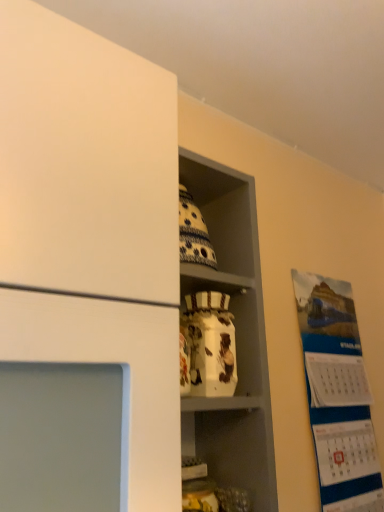
What are the coordinates of `white glossy jar at center` in the screenshot? It's located at (213, 281).

Where is `white glossy jar at center`? The width and height of the screenshot is (384, 512). white glossy jar at center is located at coordinates (213, 281).

Measure the distance between white glossy jar at center and white paper calendar at right.

They are 22.80 inches apart.

Which point is more forward, (191,268) or (336,439)?

Point (191,268)

Between white glossy jar at center and white paper calendar at right, which one is positioned behind?

white paper calendar at right is behind.

Is white glossy jar at center oriented away from white paper calendar at right?

No, white glossy jar at center's orientation is not away from white paper calendar at right.

Considering the sizes of objects white glossy vase at center and white paper calendar at right in the image provided, who is smaller, white glossy vase at center or white paper calendar at right?

white paper calendar at right.

Which object is positioned more to the left, white glossy vase at center or white paper calendar at right?

white glossy vase at center is more to the left.

Find the location of `shelf in front of the white paper calendar at right`. shelf in front of the white paper calendar at right is located at coordinates (236, 336).

Looking at their sizes, would you say white glossy jar at center is wider or thinner than white glossy vase at center?

white glossy jar at center is thinner than white glossy vase at center.

Is there a large distance between white glossy jar at center and white glossy vase at center?

No.

How distant is white glossy jar at center from white glossy vase at center?

white glossy jar at center and white glossy vase at center are 3.63 inches apart from each other.

In the image, is white paper calendar at right positioned in front of or behind white glossy jar at center?

In the image, white paper calendar at right appears behind white glossy jar at center.

Would you say white paper calendar at right is inside or outside white glossy jar at center?

white paper calendar at right lies outside white glossy jar at center.

Is white paper calendar at right to the left of white glossy jar at center from the viewer's perspective?

Incorrect, white paper calendar at right is not on the left side of white glossy jar at center.

Considering the points (328, 278) and (190, 285), which point is in front, point (328, 278) or point (190, 285)?

Point (190, 285)

Considering the positions of point (226, 410) and point (223, 280), is point (226, 410) closer or farther from the camera than point (223, 280)?

Clearly, point (226, 410) is closer to the camera than point (223, 280).

Considering the relative sizes of white glossy vase at center and white glossy jar at center in the image provided, is white glossy vase at center wider than white glossy jar at center?

Correct, the width of white glossy vase at center exceeds that of white glossy jar at center.

From a real-world perspective, which is physically below, white glossy vase at center or white glossy jar at center?

From a 3D spatial view, white glossy jar at center is below.

From the image's perspective, is white paper calendar at right under white glossy vase at center?

Correct, white paper calendar at right appears lower than white glossy vase at center in the image.

From a real-world perspective, who is located lower, white paper calendar at right or white glossy vase at center?

white paper calendar at right is physically lower.

Is white paper calendar at right aimed at white glossy vase at center?

No.

Is point (331, 486) in front of point (229, 410)?

No, (331, 486) is behind (229, 410).

The width and height of the screenshot is (384, 512). Identify the location of cabinet in front of the white paper calendar at right. (213, 281).

Find the location of a particular element. The width and height of the screenshot is (384, 512). shelf on the left of white paper calendar at right is located at coordinates (236, 336).

From the image, which object appears to be nearer to white glossy jar at center, white glossy vase at center or white paper calendar at right?

white glossy vase at center is closer to white glossy jar at center.

Estimate the real-world distances between objects in this image. Which object is closer to white paper calendar at right, white glossy vase at center or white glossy jar at center?

Answer: white glossy vase at center.

When comparing their distances from white glossy jar at center, does white paper calendar at right or white glossy vase at center seem further?

Among the two, white paper calendar at right is located further to white glossy jar at center.

Considering their positions, is white paper calendar at right positioned closer to white glossy vase at center than white glossy jar at center?

white glossy jar at center is positioned closer to the anchor white glossy vase at center.

When comparing their distances from white paper calendar at right, does white glossy jar at center or white glossy vase at center seem further?

white glossy jar at center.

Considering their positions, is white glossy jar at center positioned further to white glossy vase at center than white paper calendar at right?

white paper calendar at right.

You are a GUI agent. You are given a task and a screenshot of the screen. Output one action in this format:
    pyautogui.click(x=<x>, y=<y>)
    Task: Click on the cabinet between white glossy vase at center and white paper calendar at right
    The width and height of the screenshot is (384, 512).
    Given the screenshot: What is the action you would take?
    213,281